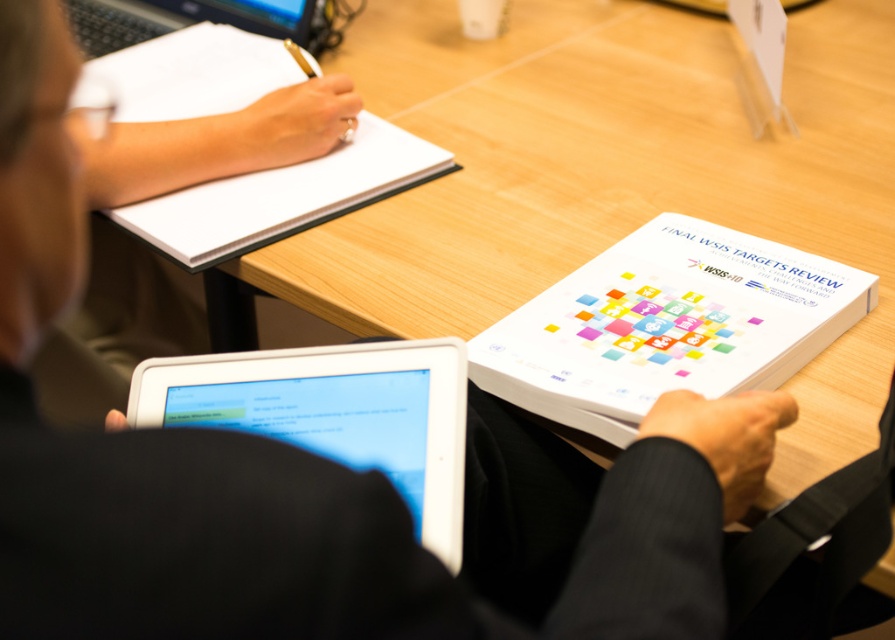
You are organizing a presentation and need to choose between the white glossy tablet at lower left and the black plastic laptop at upper left. Which device has a smaller screen width?

The white glossy tablet at lower left has a smaller screen width than the black plastic laptop at upper left.

From the picture: You are organizing a presentation and need to choose between the white glossy tablet at lower left and the black plastic laptop at upper left. Which device has a larger screen size?

The white glossy tablet at lower left has a greater height compared to the black plastic laptop at upper left, so it has a larger screen size.

You are organizing a workshop and need to choose between using the white paper at center and the black plastic laptop at upper left for participants to take notes. Based on their sizes, which would be more suitable for writing longer texts?

The white paper at center is larger in size than the black plastic laptop at upper left, making it more suitable for writing longer texts as there is more space available.